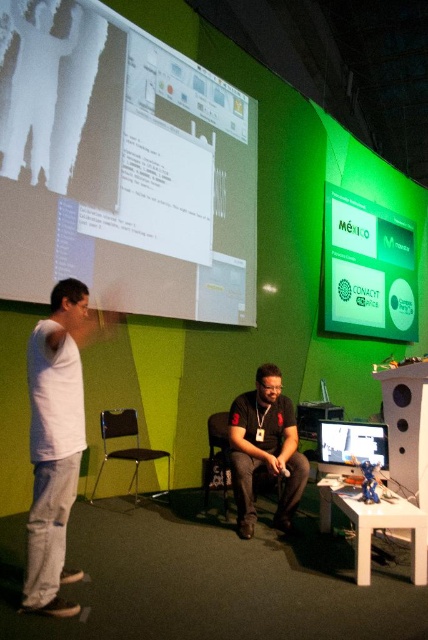
Please describe the location of the white matte projection screen at upper left in the image using the coordinate system where the bottom left corner is the origin point. The coordinate is given as a point in the format of x,y. The image has a width of 1 unit and a height of 1 unit. The coordinate system is normalized such that the bottom left corner is at 0,0 and the top right corner is at 1,1. The white matte projection screen at upper left is located at point (121, 164). Please confirm if this is the x

The white matte projection screen at upper left is located at coordinate point (121, 164) in the normalized coordinate system where the bottom left corner is the origin point.